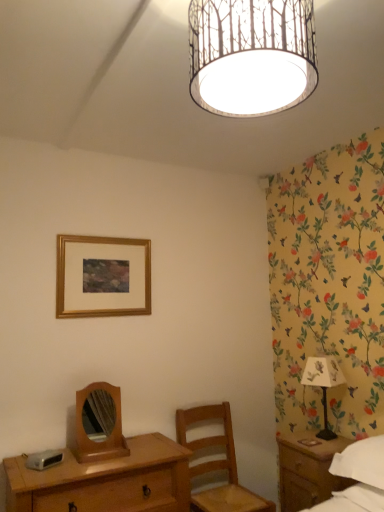
Question: From the image's perspective, is wooden desk at lower left on top of wooden chair at center?

Choices:
 (A) yes
 (B) no

Answer: (A)

Question: Is wooden chair at center at the back of wooden desk at lower left?

Choices:
 (A) no
 (B) yes

Answer: (A)

Question: Is wooden desk at lower left closer to the viewer compared to wooden chair at center?

Choices:
 (A) yes
 (B) no

Answer: (A)

Question: Is wooden desk at lower left not near wooden chair at center?

Choices:
 (A) yes
 (B) no

Answer: (B)

Question: Is wooden desk at lower left further to the viewer compared to wooden chair at center?

Choices:
 (A) yes
 (B) no

Answer: (B)

Question: Visually, is gold wooden picture frame at upper center positioned to the left or to the right of wooden mirror at center?

Choices:
 (A) right
 (B) left

Answer: (B)

Question: From the image's perspective, is gold wooden picture frame at upper center above or below wooden mirror at center?

Choices:
 (A) below
 (B) above

Answer: (B)

Question: Is gold wooden picture frame at upper center wider or thinner than wooden mirror at center?

Choices:
 (A) thin
 (B) wide

Answer: (A)

Question: Is gold wooden picture frame at upper center in front of or behind wooden mirror at center in the image?

Choices:
 (A) behind
 (B) front

Answer: (A)

Question: Is point (352, 446) closer or farther from the camera than point (251, 22)?

Choices:
 (A) farther
 (B) closer

Answer: (A)

Question: In terms of height, does white cotton bed at lower right look taller or shorter compared to white paper with tree pattern at upper center?

Choices:
 (A) short
 (B) tall

Answer: (A)

Question: From a real-world perspective, relative to white paper with tree pattern at upper center, is white cotton bed at lower right vertically above or below?

Choices:
 (A) above
 (B) below

Answer: (B)

Question: Based on their sizes in the image, would you say white cotton bed at lower right is bigger or smaller than white paper with tree pattern at upper center?

Choices:
 (A) big
 (B) small

Answer: (B)

Question: From a real-world perspective, relative to wooden mirror at center, is wooden chair at center vertically above or below?

Choices:
 (A) below
 (B) above

Answer: (A)

Question: Considering the positions of wooden chair at center and wooden mirror at center in the image, is wooden chair at center taller or shorter than wooden mirror at center?

Choices:
 (A) short
 (B) tall

Answer: (B)